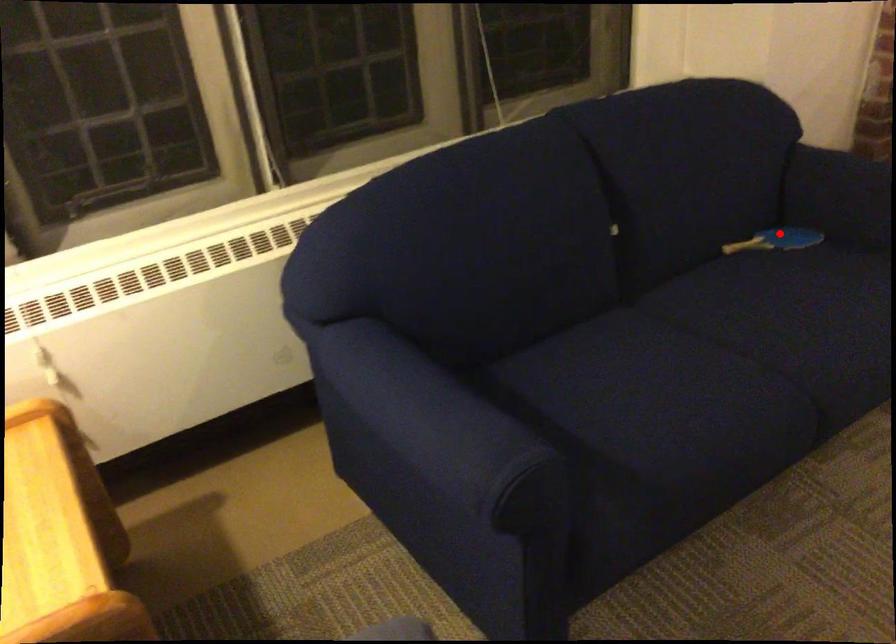
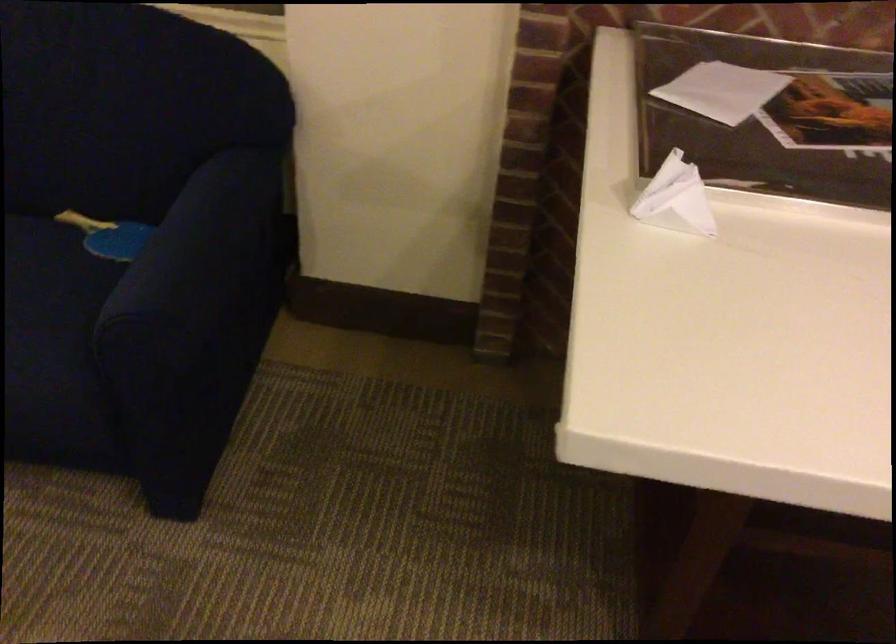
Question: I am providing you with two images of the same scene from different viewpoints. A red point is shown in image1. For the corresponding object point in image2, is it positioned nearer or farther from the camera?

Choices:
 (A) Nearer
 (B) Farther

Answer: (A)